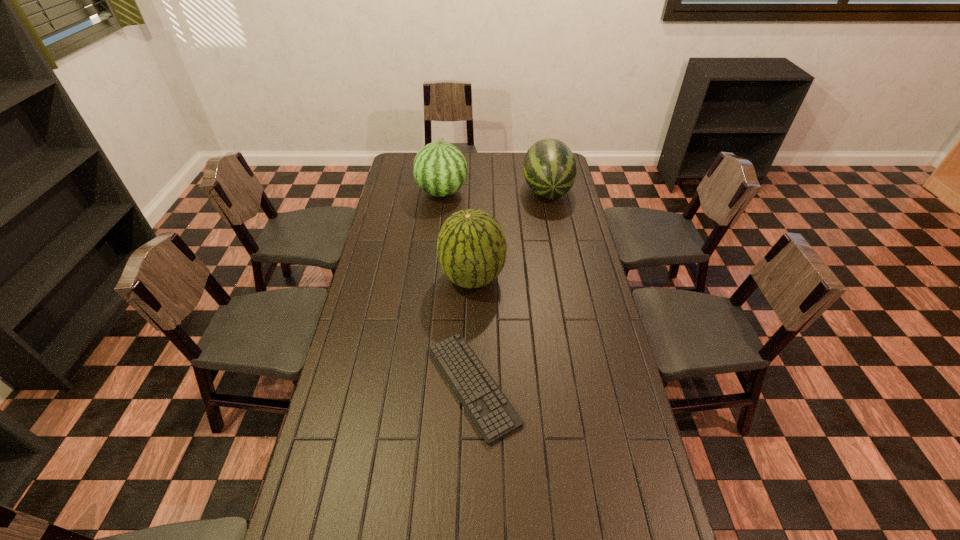
Identify the location of object positioned at the right edge. The image size is (960, 540). (549, 168).

Where is `object that is at the far right corner`? object that is at the far right corner is located at coordinates (549, 168).

I want to click on free region at the left edge of the desktop, so click(357, 418).

Locate an element on the screen. Image resolution: width=960 pixels, height=540 pixels. vacant area at the right edge of the desktop is located at coordinates (609, 382).

In the image, there is a desktop. In order to click on vacant space at the far left corner in this screenshot , I will do `click(392, 173)`.

The width and height of the screenshot is (960, 540). What are the coordinates of `vacant point located between the nearest watermelon and the nearest object` in the screenshot? It's located at (472, 332).

Identify the location of free space between the computer keyboard and the nearest watermelon. The height and width of the screenshot is (540, 960). (472, 332).

What are the coordinates of `free area in between the nearest object and the rightmost object` in the screenshot? It's located at (510, 287).

You are a GUI agent. You are given a task and a screenshot of the screen. Output one action in this format:
    pyautogui.click(x=<x>, y=<y>)
    Task: Click on the blank region between the shortest object and the rightmost watermelon
    This screenshot has height=540, width=960.
    Given the screenshot: What is the action you would take?
    (x=510, y=287)

You are a GUI agent. You are given a task and a screenshot of the screen. Output one action in this format:
    pyautogui.click(x=<x>, y=<y>)
    Task: Click on the object that is the second closest to the third farthest object
    
    Given the screenshot: What is the action you would take?
    pyautogui.click(x=440, y=169)